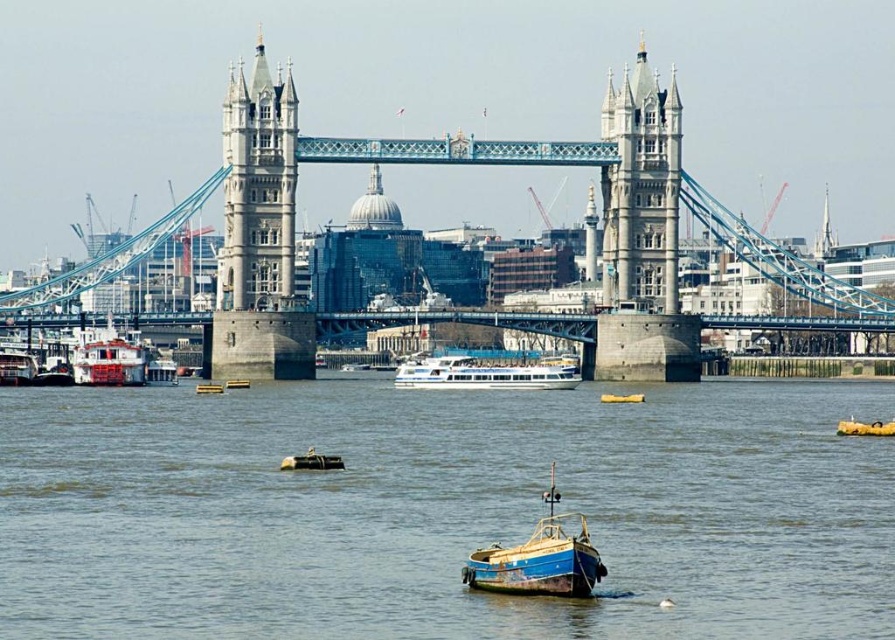
You are a photographer planning to capture the Tower Bridge from the river. You have two boats available for the shoot. The blue wooden boat at center and the metallic blue boat at center. Which boat should you choose if you want to have more space for your equipment?

The blue wooden boat at center is bigger than the metallic blue boat at center, so you should choose the blue wooden boat at center for more space.

You are a photographer planning to take a photo of the Tower Bridge from the river. You have two boats available for your shoot, a blue wooden boat at center and a metallic blue boat at center. Since you want to ensure the bridge towers are fully visible in your photo, which boat should you choose based on their height?

The blue wooden boat at center has a greater height compared to the metallic blue boat at center, so choosing the metallic blue boat at center would be better to ensure the bridge towers are fully visible in your photo.

Consider the image. You are a boat captain trying to navigate your yellow plastic boat at center under the blue metallic bridge at center. Based on the scene description, will your boat fit through the opening of the bridge?

The blue metallic bridge at center is wider than the yellow plastic boat at center, so the boat should fit through the opening as the bridge is wider.